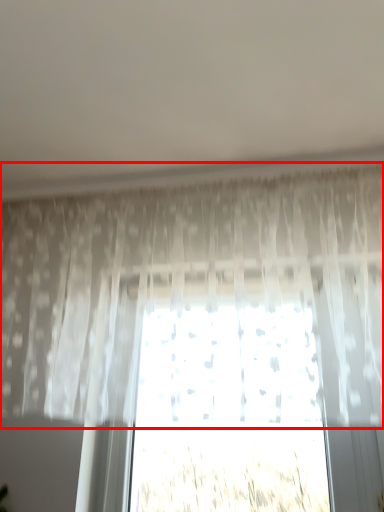
Question: From the image's perspective, considering the relative positions of curtain (annotated by the red box) and plant in the image provided, where is curtain (annotated by the red box) located with respect to the staircase?

Choices:
 (A) above
 (B) below

Answer: (A)